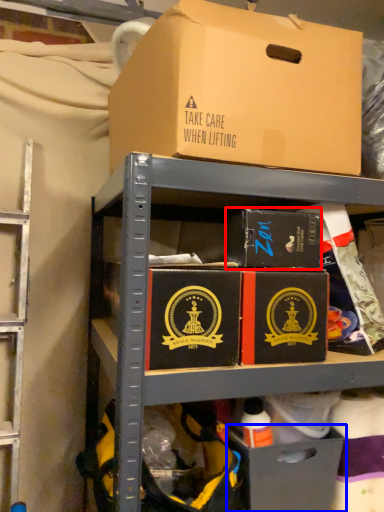
Question: Which object is further to the camera taking this photo, box (highlighted by a red box) or drawer (highlighted by a blue box)?

Choices:
 (A) box
 (B) drawer

Answer: (B)